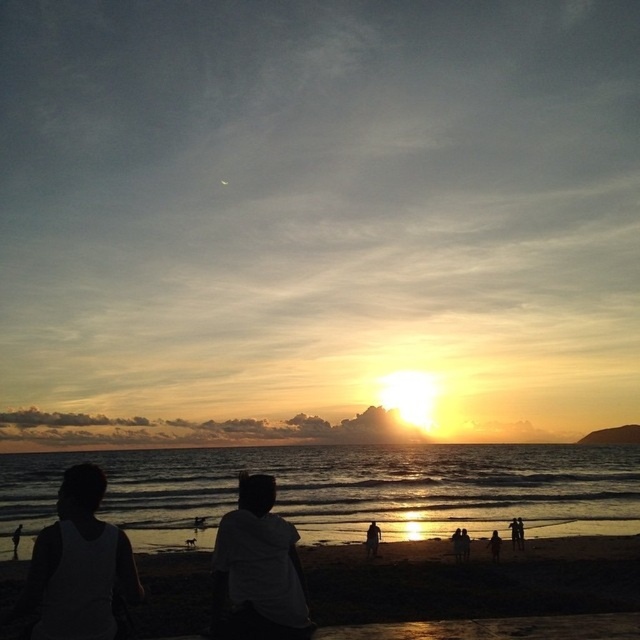
Question: Which point is farther from the camera taking this photo?

Choices:
 (A) (513, 605)
 (B) (371, 536)
 (C) (496, 557)
 (D) (304, 618)

Answer: (B)

Question: Is white matte tank top at lower left closer to the viewer compared to white matte shirt at center?

Choices:
 (A) no
 (B) yes

Answer: (B)

Question: Is silhouette sand at lower center behind silhouette figure at lower right?

Choices:
 (A) yes
 (B) no

Answer: (B)

Question: Is shiny metallic water at center to the right of white matte shirt at center from the viewer's perspective?

Choices:
 (A) no
 (B) yes

Answer: (A)

Question: Which of the following is the closest to the observer?

Choices:
 (A) silhouette figure at lower right
 (B) white matte shirt at center
 (C) shiny metallic water at center
 (D) white matte tank top at lower left

Answer: (D)

Question: Among these points, which one is nearest to the camera?

Choices:
 (A) (323, 538)
 (B) (493, 541)
 (C) (179, 605)
 (D) (368, 547)

Answer: (C)